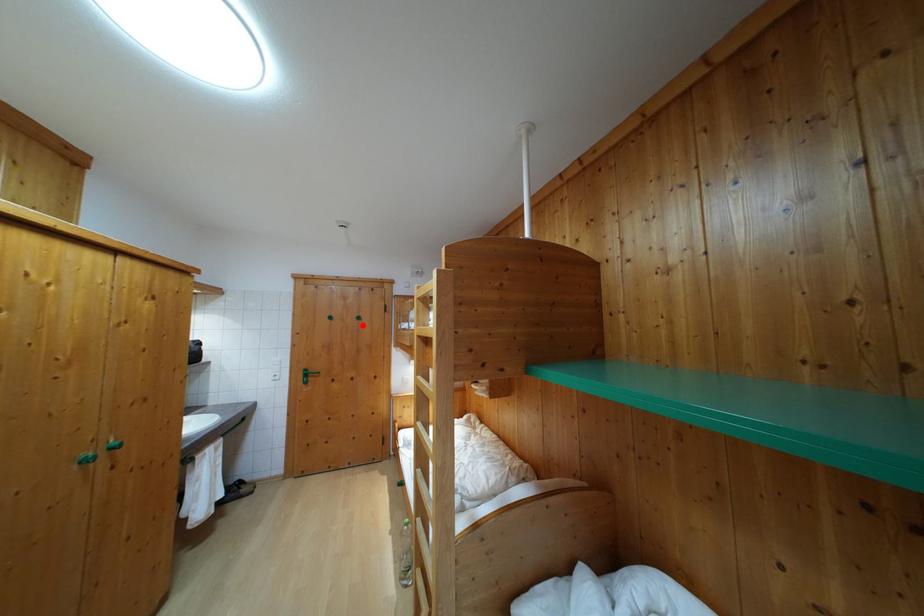
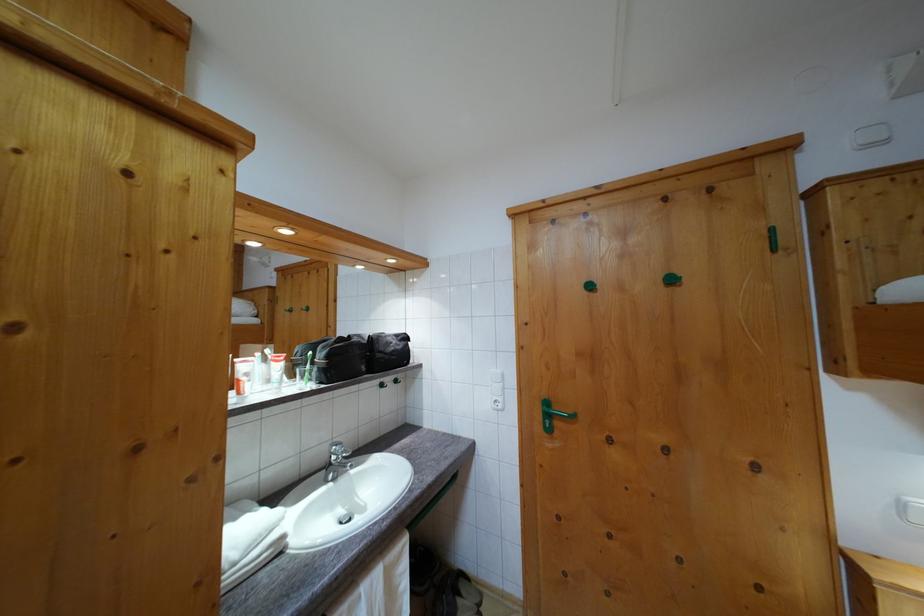
Find the pixel in the second image that matches the highlighted location in the first image.

(675, 286)